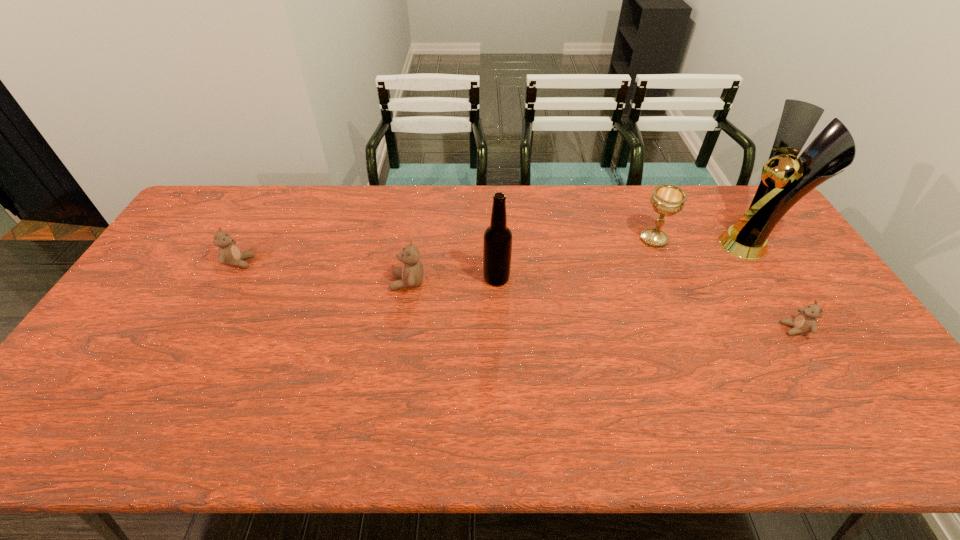
Identify the location of vacant position located 0.100m at the front of the award, where the globe is visible. This screenshot has width=960, height=540. (688, 244).

Locate an element on the screen. The image size is (960, 540). vacant space located 0.310m at the front of the award, where the globe is visible is located at coordinates (624, 244).

Identify the location of vacant position located on the right of the fifth shortest object. (620, 278).

Locate an element on the screen. object at the far edge is located at coordinates coord(784,181).

You are a GUI agent. You are given a task and a screenshot of the screen. Output one action in this format:
    pyautogui.click(x=<x>, y=<y>)
    Task: Click on the teddy bear that is at the right edge
    This screenshot has height=540, width=960.
    Given the screenshot: What is the action you would take?
    pyautogui.click(x=805, y=322)

This screenshot has width=960, height=540. Find the location of `award situated at the right edge`. award situated at the right edge is located at coordinates (784, 181).

Identify the location of object located in the far right corner section of the desktop. click(784, 181).

The image size is (960, 540). I want to click on vacant space at the far edge, so click(592, 202).

At what (x,y) coordinates should I click in order to perform the action: click on vacant space at the near edge of the desktop. Please return your answer as a coordinate pair (x, y). Looking at the image, I should click on (445, 370).

The width and height of the screenshot is (960, 540). I want to click on free region at the right edge, so click(823, 288).